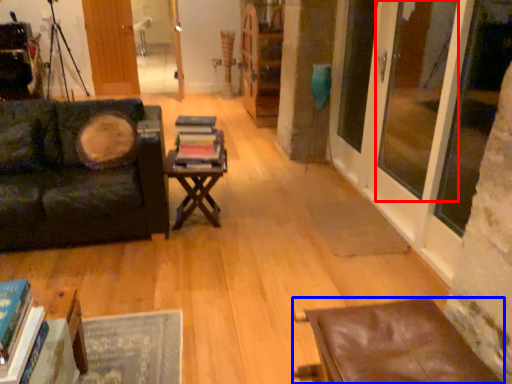
Question: Which of the following is the farthest to the observer, window screen (highlighted by a red box) or table (highlighted by a blue box)?

Choices:
 (A) window screen
 (B) table

Answer: (A)